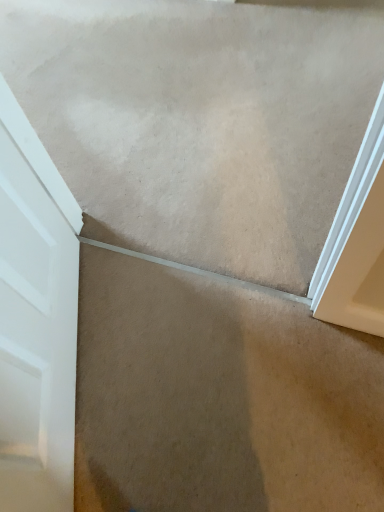
This screenshot has width=384, height=512. What do you see at coordinates (219, 397) in the screenshot?
I see `beige carpet at center` at bounding box center [219, 397].

Where is `beige carpet at center`? Image resolution: width=384 pixels, height=512 pixels. beige carpet at center is located at coordinates (219, 397).

The height and width of the screenshot is (512, 384). Identify the location of beige carpet at center. (219, 397).